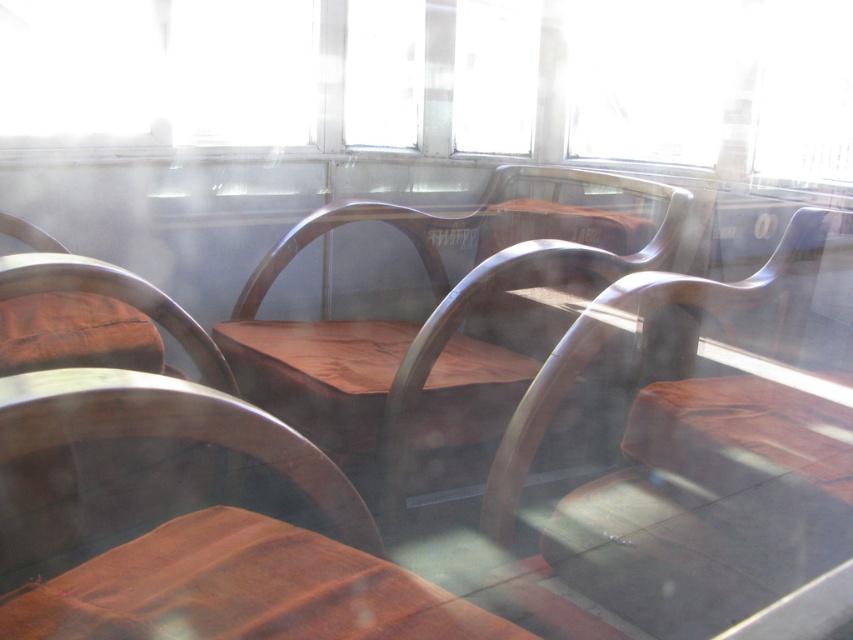
Question: Which of these objects is positioned farthest from the wooden polished chair at center?

Choices:
 (A) transparent glass window at upper center
 (B) shiny brown wood chair at center
 (C) brown leather table at lower left

Answer: (C)

Question: Is wooden polished chair at center above brown leather table at lower left?

Choices:
 (A) yes
 (B) no

Answer: (A)

Question: Considering the relative positions of wooden seat at center and transparent glass window at upper center in the image provided, where is wooden seat at center located with respect to transparent glass window at upper center?

Choices:
 (A) below
 (B) above

Answer: (A)

Question: Which of the following is the closest to the observer?

Choices:
 (A) transparent glass window at upper center
 (B) wooden polished chair at center
 (C) brown leather table at lower left

Answer: (C)

Question: In this image, where is wooden seat at center located relative to shiny brown wood chair at center?

Choices:
 (A) right
 (B) left

Answer: (A)

Question: Among these objects, which one is farthest from the camera?

Choices:
 (A) transparent glass window at upper center
 (B) wooden seat at center
 (C) wooden polished chair at center
 (D) shiny brown wood chair at center

Answer: (A)